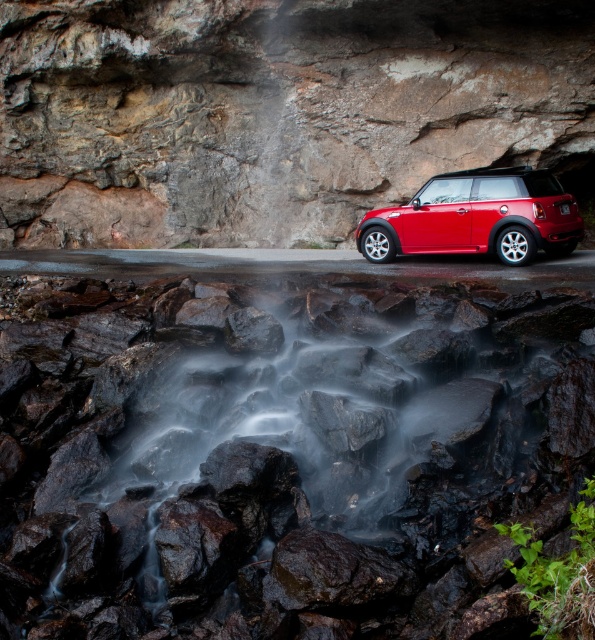
Between matte rock cliff at upper center and glossy metallic car at center, which one has less height?

With less height is glossy metallic car at center.

Is point (357, 1) positioned behind point (428, 236)?

Yes, point (357, 1) is behind point (428, 236).

Is point (352, 163) behind point (572, 211)?

Yes.

Find the location of a particular element. matte rock cliff at upper center is located at coordinates (274, 112).

Is glossy rock at center taller than glossy metallic car at center?

In fact, glossy rock at center may be shorter than glossy metallic car at center.

Can you confirm if glossy rock at center is bigger than glossy metallic car at center?

No, glossy rock at center is not bigger than glossy metallic car at center.

Identify the location of glossy rock at center. The image size is (595, 640). tap(283, 452).

Can you confirm if glossy rock at center is positioned to the right of matte rock cliff at upper center?

Yes, glossy rock at center is to the right of matte rock cliff at upper center.

Between glossy rock at center and matte rock cliff at upper center, which one is positioned higher?

matte rock cliff at upper center

This screenshot has width=595, height=640. I want to click on glossy rock at center, so click(283, 452).

At what (x,y) coordinates should I click in order to perform the action: click on glossy rock at center. Please return your answer as a coordinate pair (x, y). Looking at the image, I should click on (283, 452).